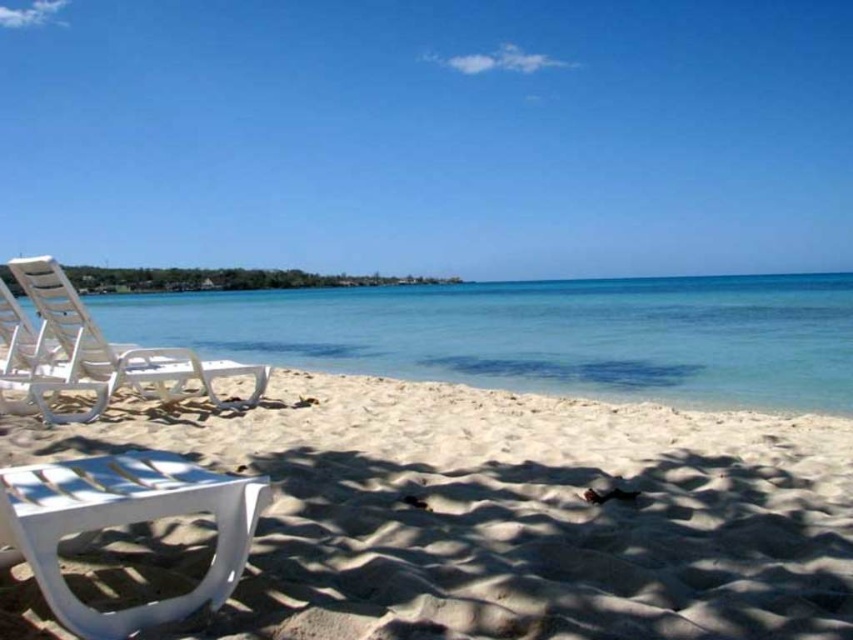
Question: Which object is positioned closest to the white plastic beach chair at left?

Choices:
 (A) clear blue water at center
 (B) white plastic chair at lower left

Answer: (B)

Question: Is white sand at lower left bigger than white plastic beach chair at left?

Choices:
 (A) yes
 (B) no

Answer: (B)

Question: Does white sand at lower left have a smaller size compared to white plastic beach chair at left?

Choices:
 (A) yes
 (B) no

Answer: (A)

Question: Estimate the real-world distances between objects in this image. Which object is closer to the white plastic chair at lower left?

Choices:
 (A) white plastic beach chair at left
 (B) clear blue water at center

Answer: (A)

Question: Does clear blue water at center have a lesser width compared to white plastic beach chair at left?

Choices:
 (A) yes
 (B) no

Answer: (B)

Question: Among these objects, which one is nearest to the camera?

Choices:
 (A) white sand at lower left
 (B) white plastic beach chair at left
 (C) white plastic chair at lower left
 (D) clear blue water at center

Answer: (C)